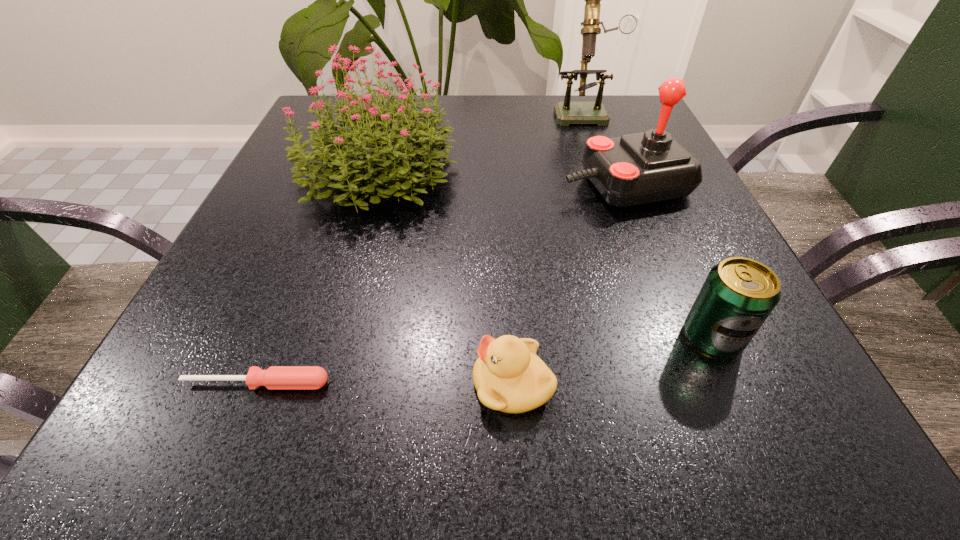
In the image, there is a desktop. What are the coordinates of `vacant space at the far right corner` in the screenshot? It's located at (604, 130).

You are a GUI agent. You are given a task and a screenshot of the screen. Output one action in this format:
    pyautogui.click(x=<x>, y=<y>)
    Task: Click on the empty location between the microscope and the screwdriver
    The width and height of the screenshot is (960, 540).
    Given the screenshot: What is the action you would take?
    pyautogui.click(x=420, y=247)

The width and height of the screenshot is (960, 540). Identify the location of free space between the tallest object and the shortest object. (420, 247).

Where is `empty location between the joystick and the shortest object`? This screenshot has width=960, height=540. empty location between the joystick and the shortest object is located at coordinates (441, 284).

Identify the location of vacant region between the farthest object and the fifth shortest object. (480, 141).

Locate an element on the screen. Image resolution: width=960 pixels, height=540 pixels. free space between the screwdriver and the fifth tallest object is located at coordinates pos(385,383).

You are a GUI agent. You are given a task and a screenshot of the screen. Output one action in this format:
    pyautogui.click(x=<x>, y=<y>)
    Task: Click on the free space between the fourth tallest object and the fifth shortest object
    The height and width of the screenshot is (540, 960).
    Given the screenshot: What is the action you would take?
    pyautogui.click(x=544, y=255)

The width and height of the screenshot is (960, 540). Find the location of `vacant region between the joystick and the duckling`. vacant region between the joystick and the duckling is located at coordinates (569, 285).

Locate which object is the second closest to the joystick. Please provide its 2D coordinates. Your answer should be formatted as a tuple, i.e. [(x, y)], where the tuple contains the x and y coordinates of a point satisfying the conditions above.

[(402, 154)]

Identify the location of object that is the fifth closest to the tallest object. (275, 377).